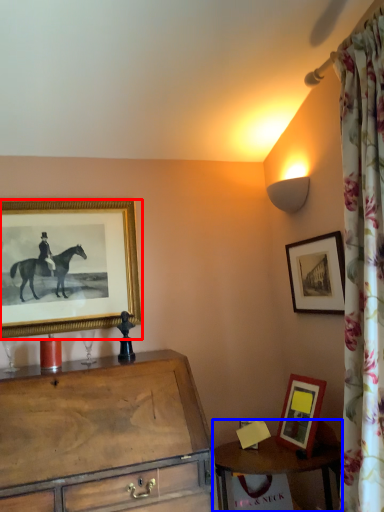
Question: Which object appears closest to the camera in this image, picture frame (highlighted by a red box) or table (highlighted by a blue box)?

Choices:
 (A) picture frame
 (B) table

Answer: (B)